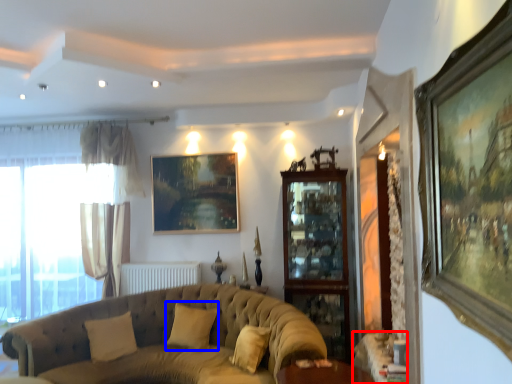
Question: Which object appears farthest to the camera in this image, table (highlighted by a red box) or pillow (highlighted by a blue box)?

Choices:
 (A) table
 (B) pillow

Answer: (B)